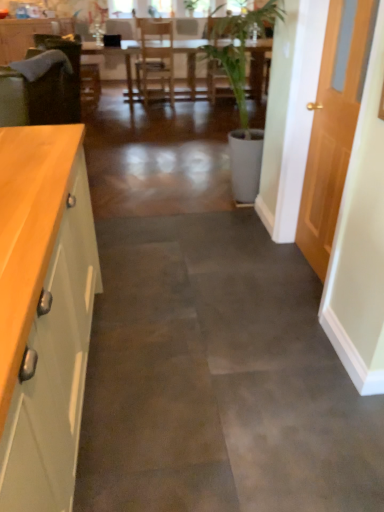
Question: Does point (362, 60) appear closer or farther from the camera than point (49, 309)?

Choices:
 (A) farther
 (B) closer

Answer: (A)

Question: From a real-world perspective, is wooden door at right positioned above or below green matte cabinet at left, which is the first cabinetry in bottom-to-top order?

Choices:
 (A) below
 (B) above

Answer: (B)

Question: Which is farther from the matte green cabinet at left, arranged as the 1th cabinetry when viewed from the left?

Choices:
 (A) green matte cabinet at left, acting as the 2th cabinetry starting from the top
 (B) wooden door at right
 (C) velvet green armchair at left
 (D) wooden table at center

Answer: (A)

Question: Estimate the real-world distances between objects in this image. Which object is closer to the matte green cabinet at left, the first cabinetry positioned from the top?

Choices:
 (A) wooden door at right
 (B) velvet green armchair at left
 (C) green matte cabinet at left, acting as the 2th cabinetry starting from the top
 (D) wooden table at center

Answer: (B)